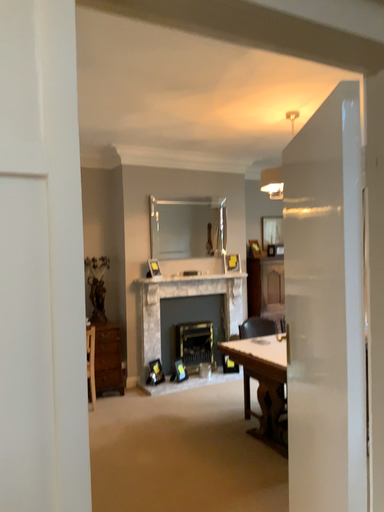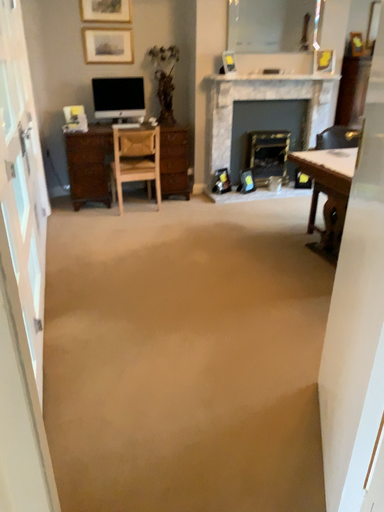
Question: How did the camera likely rotate when shooting the video?

Choices:
 (A) rotated downward
 (B) rotated upward

Answer: (A)